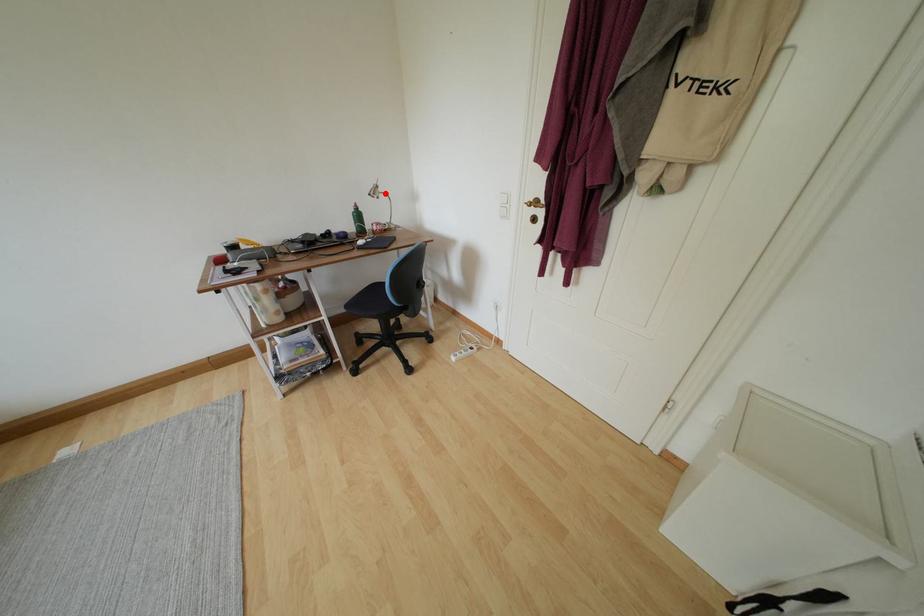
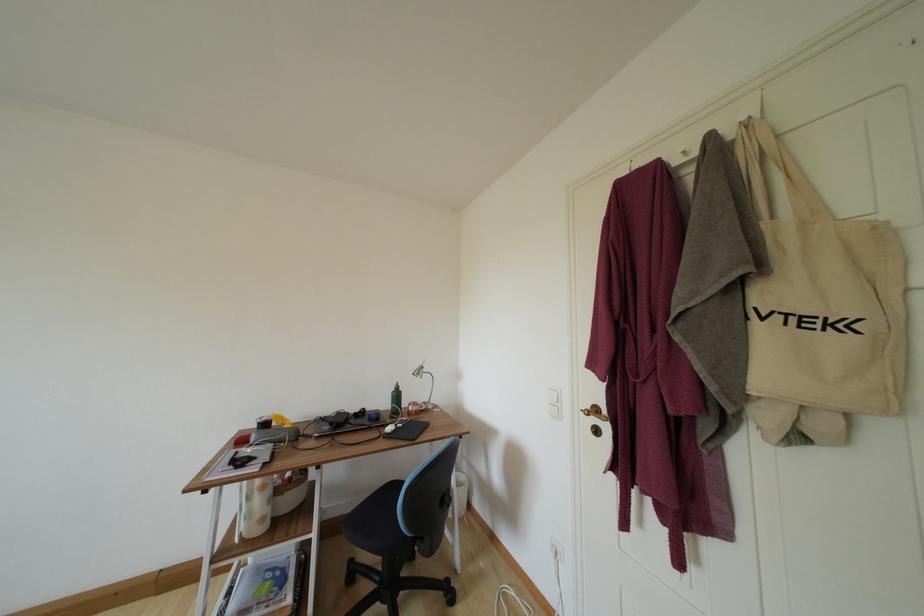
Question: I am providing you with two images of the same scene from different viewpoints. In image1, a red point is highlighted. Considering the same 3D point in image2, which of the following is correct?

Choices:
 (A) It is closer
 (B) It is farther

Answer: (B)